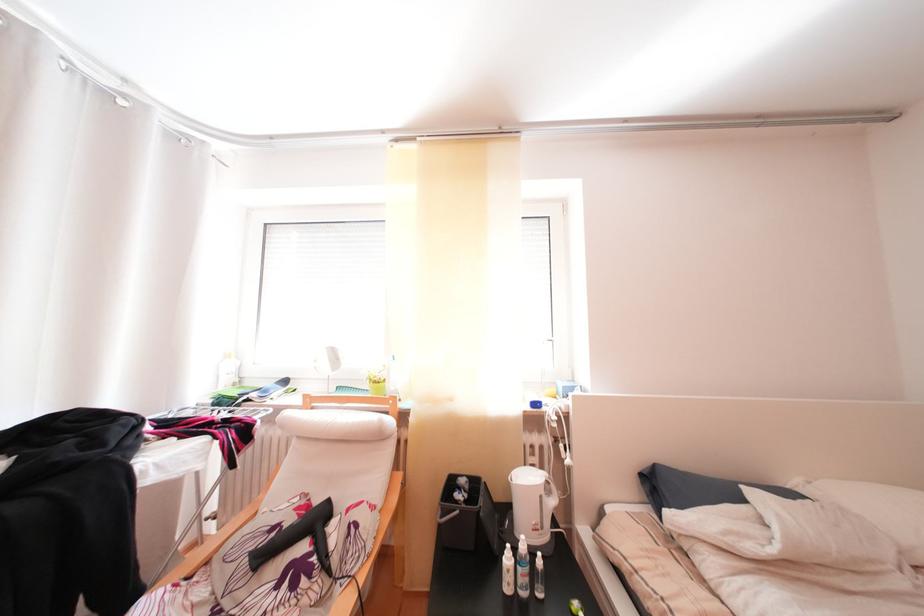
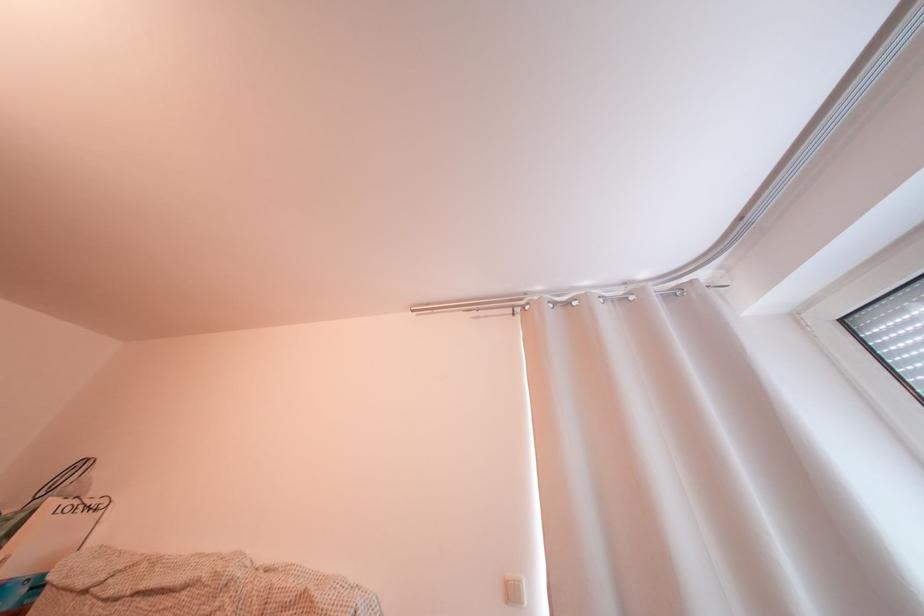
Based on the continuous images, in which direction is the camera rotating?

The camera rotated toward left-up.